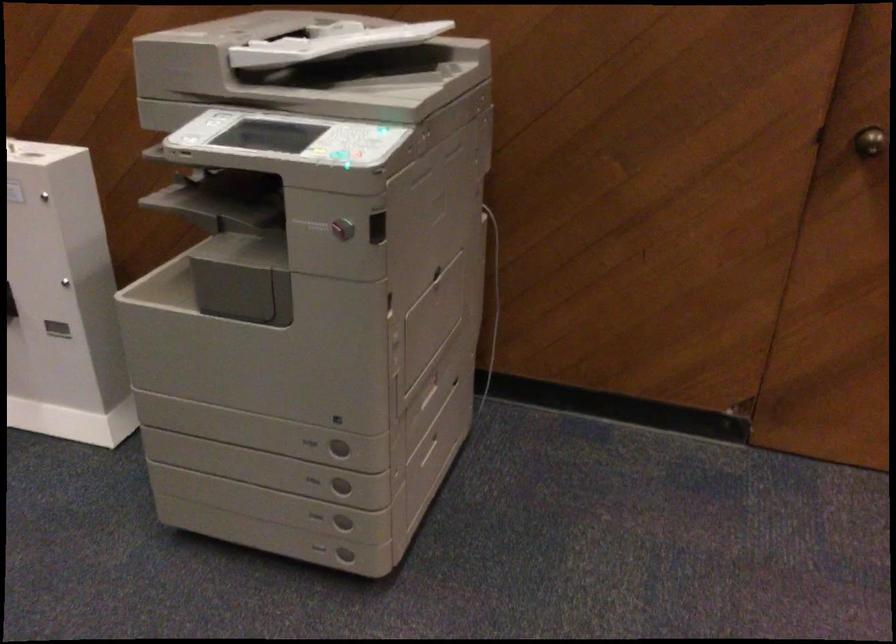
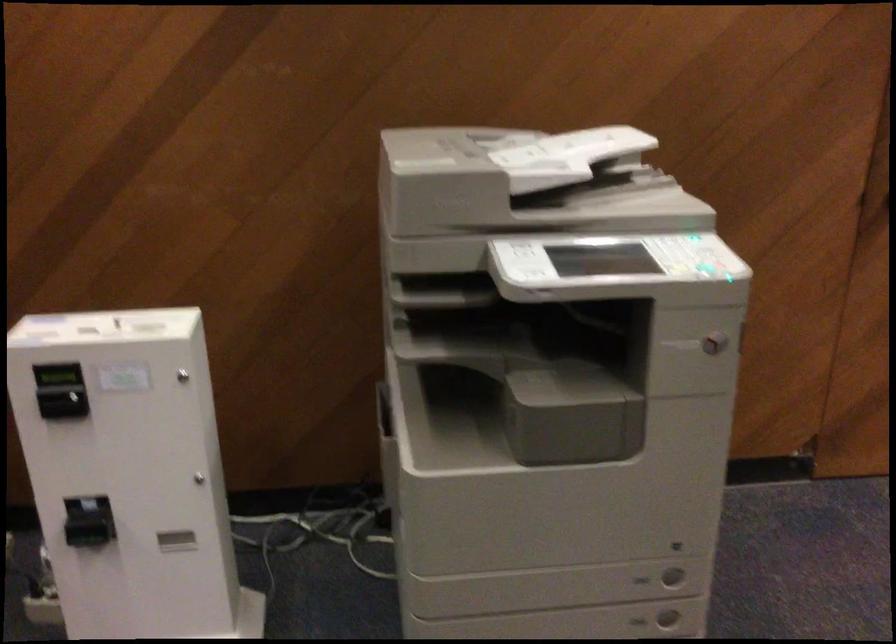
Locate, in the second image, the point that corresponds to point (349, 240) in the first image.

(713, 343)